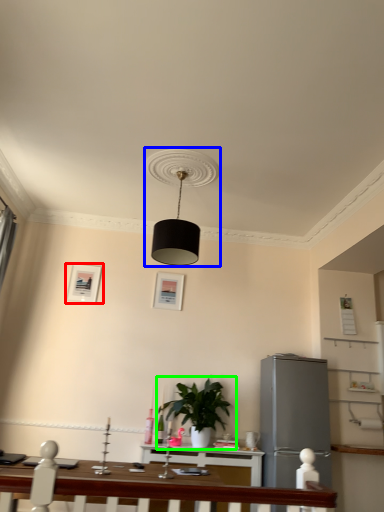
Question: Which is farther away from picture frame (highlighted by a red box)? lamp (highlighted by a blue box) or houseplant (highlighted by a green box)?

Choices:
 (A) lamp
 (B) houseplant

Answer: (A)